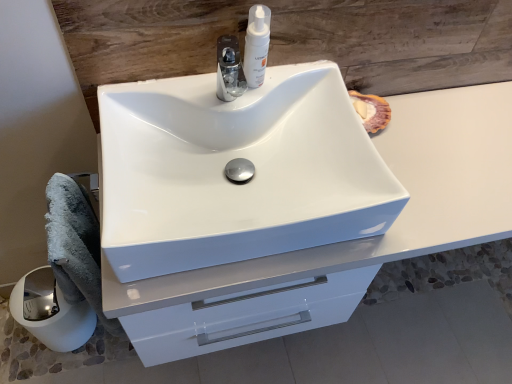
Question: Can you confirm if white glossy paper towel at lower left is shorter than gray fluffy bath towel at lower left?

Choices:
 (A) no
 (B) yes

Answer: (B)

Question: From the image's perspective, is white glossy paper towel at lower left on top of gray fluffy bath towel at lower left?

Choices:
 (A) no
 (B) yes

Answer: (A)

Question: Considering the relative positions of white glossy paper towel at lower left and gray fluffy bath towel at lower left in the image provided, is white glossy paper towel at lower left to the left of gray fluffy bath towel at lower left from the viewer's perspective?

Choices:
 (A) no
 (B) yes

Answer: (B)

Question: Does white glossy paper towel at lower left lie in front of gray fluffy bath towel at lower left?

Choices:
 (A) no
 (B) yes

Answer: (A)

Question: Is white glossy paper towel at lower left taller than gray fluffy bath towel at lower left?

Choices:
 (A) yes
 (B) no

Answer: (B)

Question: In the image, is white glossy paper towel at lower left positioned in front of or behind white glossy sink at center?

Choices:
 (A) front
 (B) behind

Answer: (B)

Question: Is white glossy paper towel at lower left bigger or smaller than white glossy sink at center?

Choices:
 (A) small
 (B) big

Answer: (A)

Question: Considering the positions of white glossy paper towel at lower left and white glossy sink at center in the image, is white glossy paper towel at lower left taller or shorter than white glossy sink at center?

Choices:
 (A) short
 (B) tall

Answer: (B)

Question: From the image's perspective, relative to white glossy sink at center, is white glossy paper towel at lower left above or below?

Choices:
 (A) above
 (B) below

Answer: (B)

Question: Based on their sizes in the image, would you say white glossy sink at center is bigger or smaller than white glossy paper towel at lower left?

Choices:
 (A) small
 (B) big

Answer: (B)

Question: Is white glossy sink at center taller or shorter than white glossy paper towel at lower left?

Choices:
 (A) short
 (B) tall

Answer: (A)

Question: Would you say white glossy sink at center is inside or outside white glossy paper towel at lower left?

Choices:
 (A) inside
 (B) outside

Answer: (B)

Question: Does point [x=265, y=125] appear closer or farther from the camera than point [x=92, y=332]?

Choices:
 (A) farther
 (B) closer

Answer: (B)

Question: Is gray fluffy bath towel at lower left in front of or behind white glossy cabinet at center in the image?

Choices:
 (A) behind
 (B) front

Answer: (A)

Question: Looking at the image, does gray fluffy bath towel at lower left seem bigger or smaller compared to white glossy cabinet at center?

Choices:
 (A) big
 (B) small

Answer: (B)